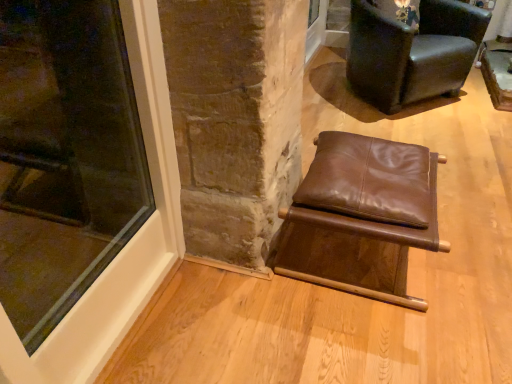
Where is `free region under brown leather stool at center, marked as the 1th chair in a bottom-to-top arrangement (from a real-world perspective)`? The height and width of the screenshot is (384, 512). free region under brown leather stool at center, marked as the 1th chair in a bottom-to-top arrangement (from a real-world perspective) is located at coordinates (365, 260).